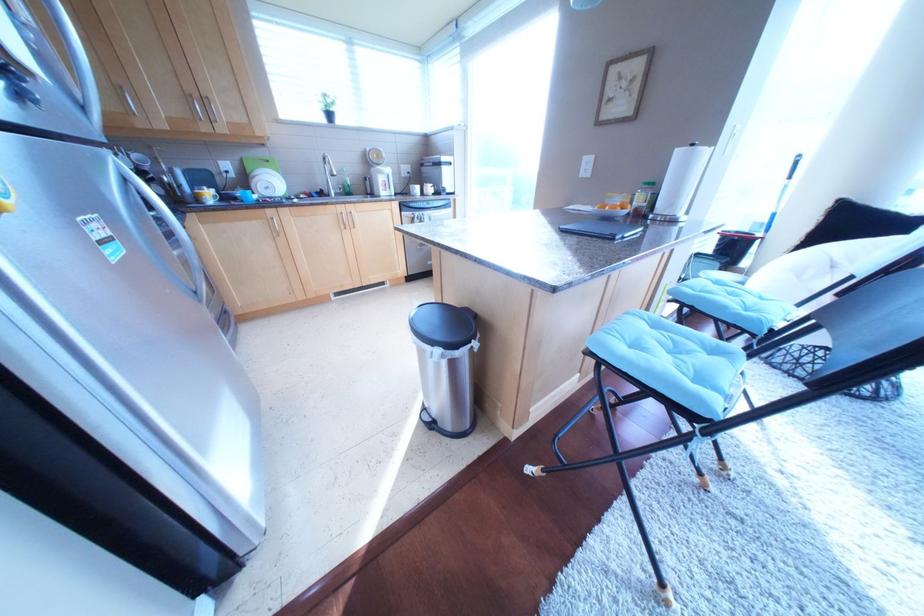
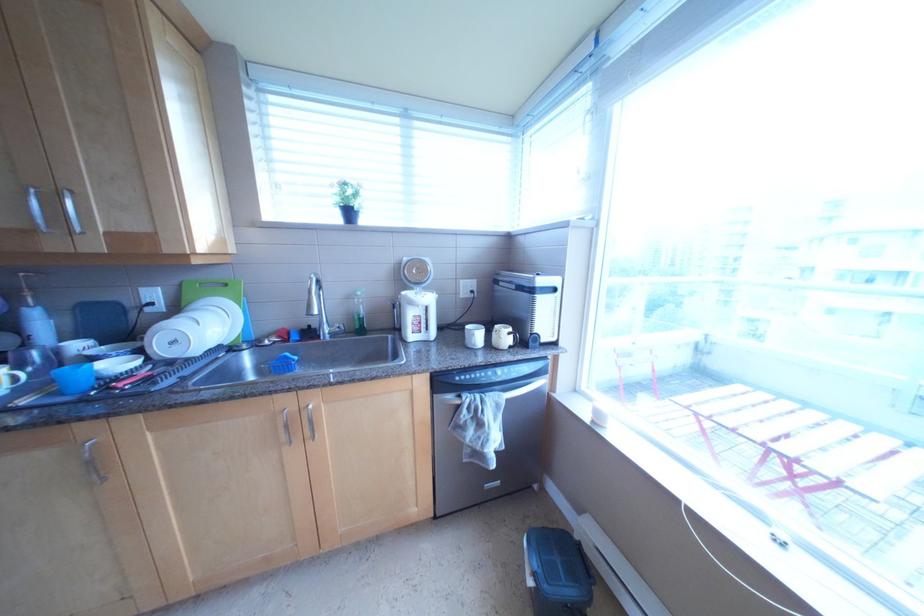
Question: Which direction would the cameraman need to move to produce the second image? Reply with the corresponding letter.

Choices:
 (A) Left
 (B) Right
 (C) Forward
 (D) Backward

Answer: (C)